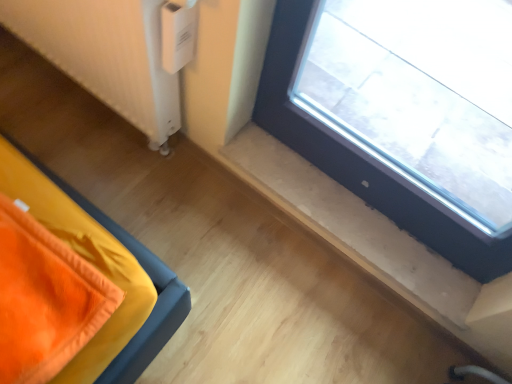
Question: Is white plastic radiator at lower left at the back of transparent glass window at upper right?

Choices:
 (A) yes
 (B) no

Answer: (B)

Question: From a real-world perspective, does transparent glass window at upper right stand above white plastic radiator at lower left?

Choices:
 (A) yes
 (B) no

Answer: (A)

Question: Is white plastic radiator at lower left completely or partially inside transparent glass window at upper right?

Choices:
 (A) no
 (B) yes

Answer: (A)

Question: Is transparent glass window at upper right not near white plastic radiator at lower left?

Choices:
 (A) no
 (B) yes

Answer: (A)

Question: Does transparent glass window at upper right have a greater width compared to white plastic radiator at lower left?

Choices:
 (A) no
 (B) yes

Answer: (A)

Question: From the image's perspective, is transparent glass window at upper right on top of white plastic radiator at lower left?

Choices:
 (A) yes
 (B) no

Answer: (B)

Question: Can transparent glass window at upper right be found inside white plastic radiator at lower left?

Choices:
 (A) no
 (B) yes

Answer: (A)

Question: Is white plastic radiator at lower left located outside transparent glass window at upper right?

Choices:
 (A) no
 (B) yes

Answer: (B)

Question: Is white plastic radiator at lower left facing away from transparent glass window at upper right?

Choices:
 (A) yes
 (B) no

Answer: (B)

Question: Can you confirm if white plastic radiator at lower left is bigger than transparent glass window at upper right?

Choices:
 (A) yes
 (B) no

Answer: (A)

Question: From a real-world perspective, is white plastic radiator at lower left physically above transparent glass window at upper right?

Choices:
 (A) no
 (B) yes

Answer: (A)

Question: Can you confirm if white plastic radiator at lower left is positioned to the left of transparent glass window at upper right?

Choices:
 (A) no
 (B) yes

Answer: (B)

Question: From the image's perspective, is transparent glass window at upper right positioned above or below white plastic radiator at lower left?

Choices:
 (A) below
 (B) above

Answer: (A)